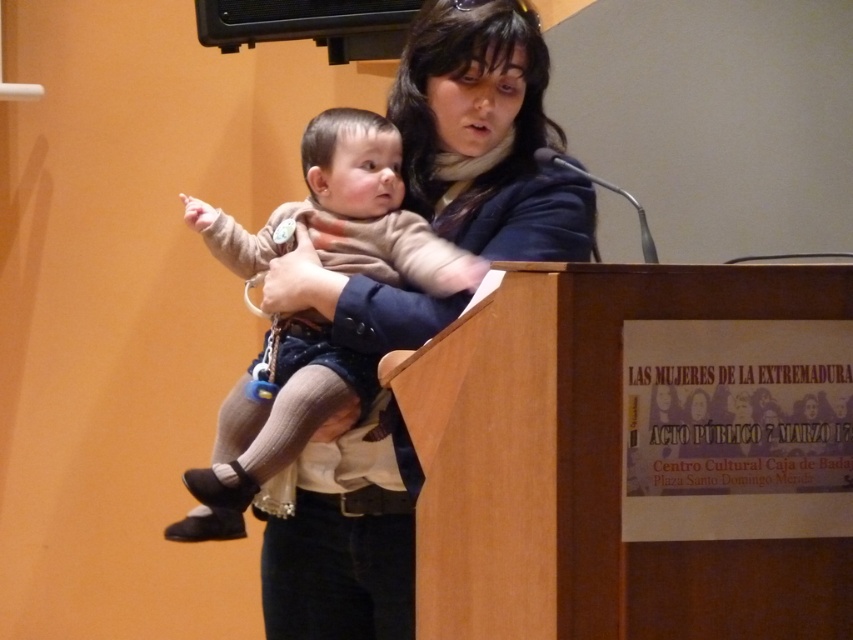
You are a tailor measuring the distance between the matte black jacket at center and the light brown knit sweater at center for a custom fitting. The minimum required distance for your tools is 5 inches. Can you work comfortably between them?

The matte black jacket at center is 5.23 inches away from the light brown knit sweater at center. Since this distance exceeds the minimum required 5 inches, you can work comfortably between them.